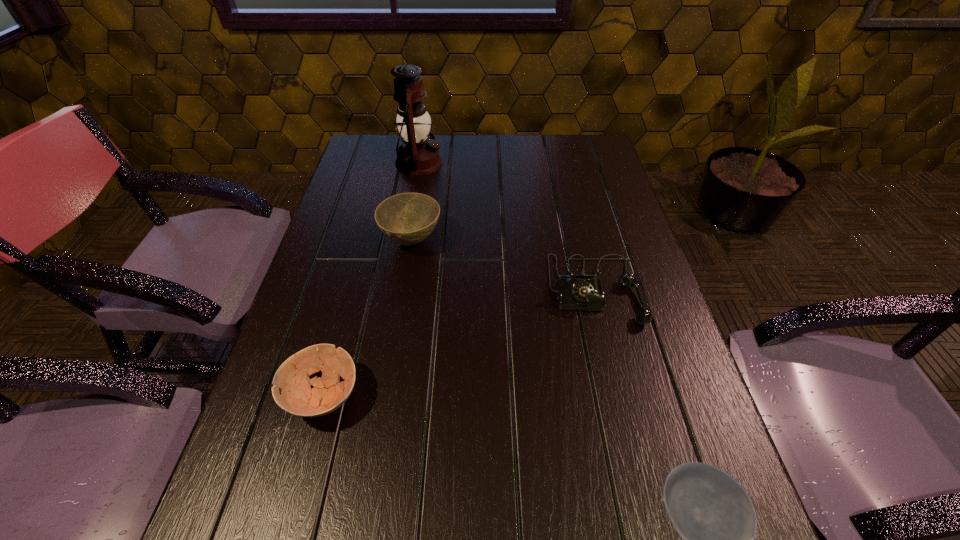
This screenshot has width=960, height=540. I want to click on the farthest object, so click(418, 155).

Find the location of a particular element. This screenshot has width=960, height=540. the tallest object is located at coordinates (418, 155).

At what (x,y) coordinates should I click in order to perform the action: click on the tallest bowl. Please return your answer as a coordinate pair (x, y). This screenshot has width=960, height=540. Looking at the image, I should click on (408, 218).

Image resolution: width=960 pixels, height=540 pixels. I want to click on telephone, so click(x=582, y=290).

Locate an element on the screen. This screenshot has height=540, width=960. the second nearest object is located at coordinates (297, 397).

Image resolution: width=960 pixels, height=540 pixels. What are the coordinates of `free space located 0.070m on the side of the tallest object, there is a wick adjustment knob` in the screenshot? It's located at [x=465, y=163].

This screenshot has width=960, height=540. I want to click on vacant space located on the front of the farthest bowl, so click(x=402, y=299).

Identify the location of vacant space located on the dial of the telephone. (649, 511).

Image resolution: width=960 pixels, height=540 pixels. I want to click on blank area located on the right of the second nearest bowl, so click(x=394, y=396).

The width and height of the screenshot is (960, 540). Identify the location of object present at the far edge. (418, 155).